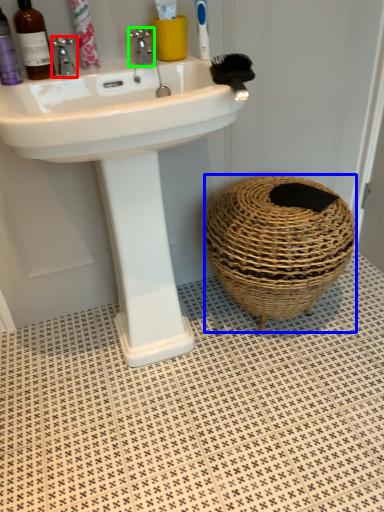
Question: Which is nearer to the tap (highlighted by a red box)? basket container (highlighted by a blue box) or tap (highlighted by a green box).

Choices:
 (A) basket container
 (B) tap

Answer: (B)